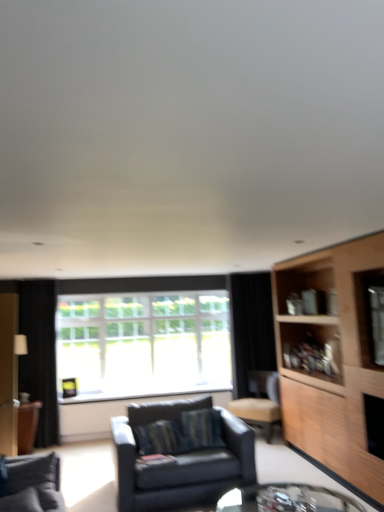
Question: Is clear glass table at lower center thinner than dark gray fabric couch at lower left, the first studio couch from the front?

Choices:
 (A) yes
 (B) no

Answer: (B)

Question: Is clear glass table at lower center not inside dark gray fabric couch at lower left, the first studio couch from the front?

Choices:
 (A) yes
 (B) no

Answer: (A)

Question: Is clear glass table at lower center turned away from dark gray fabric couch at lower left, the second studio couch viewed from the back?

Choices:
 (A) yes
 (B) no

Answer: (B)

Question: Could dark gray fabric couch at lower left, which appears as the first studio couch when viewed from the left, be considered to be inside clear glass table at lower center?

Choices:
 (A) no
 (B) yes

Answer: (A)

Question: Can you confirm if clear glass table at lower center is taller than dark gray fabric couch at lower left, the first studio couch from the front?

Choices:
 (A) yes
 (B) no

Answer: (B)

Question: From the image's perspective, is light wood cabinet at right positioned above or below leather-like beige chair at center-right?

Choices:
 (A) above
 (B) below

Answer: (A)

Question: Would you say light wood cabinet at right is to the left or to the right of leather-like beige chair at center-right in the picture?

Choices:
 (A) right
 (B) left

Answer: (A)

Question: Is light wood cabinet at right taller or shorter than leather-like beige chair at center-right?

Choices:
 (A) tall
 (B) short

Answer: (A)

Question: In terms of width, does light wood cabinet at right look wider or thinner when compared to leather-like beige chair at center-right?

Choices:
 (A) thin
 (B) wide

Answer: (A)

Question: Is leather-like beige chair at center-right taller or shorter than dark gray fabric couch at lower left, the first studio couch from the front?

Choices:
 (A) tall
 (B) short

Answer: (A)

Question: In terms of size, does leather-like beige chair at center-right appear bigger or smaller than dark gray fabric couch at lower left, the second studio couch viewed from the back?

Choices:
 (A) small
 (B) big

Answer: (B)

Question: Relative to dark gray fabric couch at lower left, the second studio couch viewed from the back, is leather-like beige chair at center-right in front or behind?

Choices:
 (A) behind
 (B) front

Answer: (A)

Question: From a real-world perspective, relative to dark gray fabric couch at lower left, the second studio couch viewed from the back, is leather-like beige chair at center-right vertically above or below?

Choices:
 (A) above
 (B) below

Answer: (B)

Question: In the image, is clear glass window at center positioned in front of or behind leather-like beige chair at center-right?

Choices:
 (A) behind
 (B) front

Answer: (A)

Question: Based on their positions, is clear glass window at center located to the left or right of leather-like beige chair at center-right?

Choices:
 (A) right
 (B) left

Answer: (B)